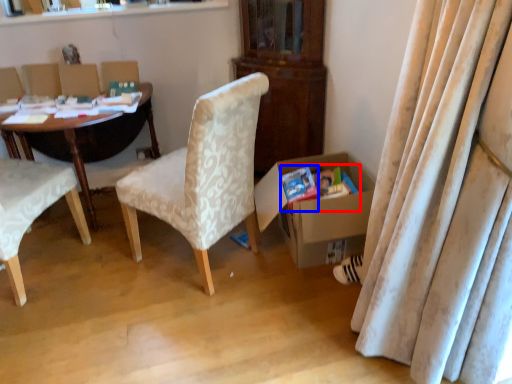
Question: Which of the following is the closest to the observer, magazine (highlighted by a red box) or paperback book (highlighted by a blue box)?

Choices:
 (A) magazine
 (B) paperback book

Answer: (B)